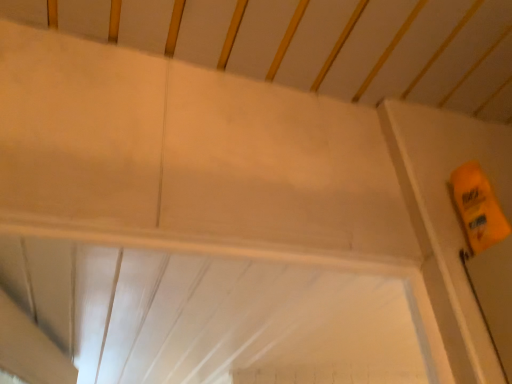
I want to click on white plastic window frame at upper center, so click(221, 316).

Describe the element at coordinates (221, 316) in the screenshot. I see `white plastic window frame at upper center` at that location.

Where is `white plastic window frame at upper center`? The width and height of the screenshot is (512, 384). white plastic window frame at upper center is located at coordinates (221, 316).